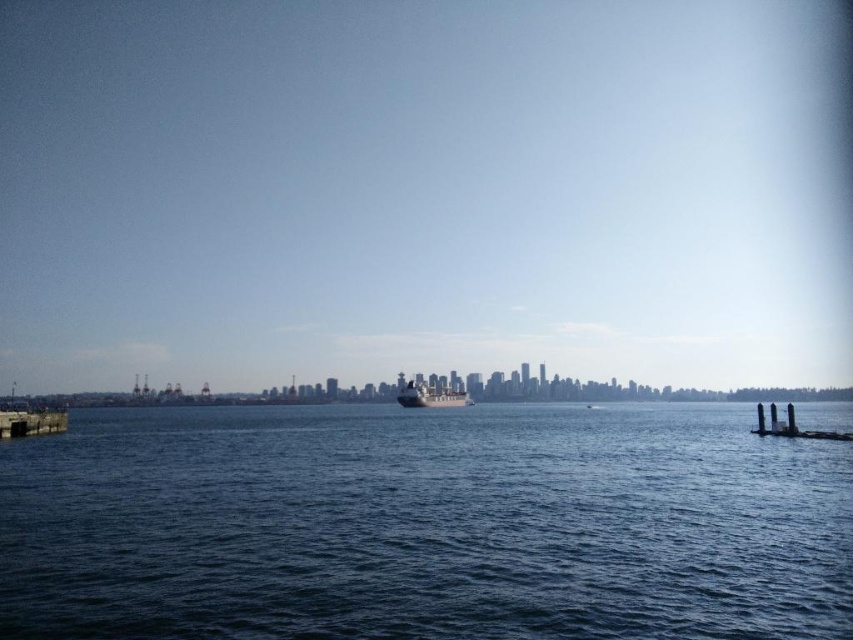
Question: Is blue water at center closer to camera compared to smooth concrete pillars at lower right?

Choices:
 (A) no
 (B) yes

Answer: (B)

Question: Which point is farther to the camera?

Choices:
 (A) (271, 465)
 (B) (839, 436)

Answer: (B)

Question: Among these points, which one is nearest to the camera?

Choices:
 (A) (817, 435)
 (B) (56, 417)
 (C) (430, 387)
 (D) (170, 628)

Answer: (D)

Question: Is blue water at center to the left of metallic gray ship at center from the viewer's perspective?

Choices:
 (A) yes
 (B) no

Answer: (A)

Question: Can you confirm if metallic gray ship at center is positioned to the left of smooth concrete pillars at lower right?

Choices:
 (A) yes
 (B) no

Answer: (A)

Question: Which of the following is the closest to the observer?

Choices:
 (A) blue water at center
 (B) concrete pier at lower left
 (C) smooth concrete pillars at lower right
 (D) metallic gray ship at center

Answer: (A)